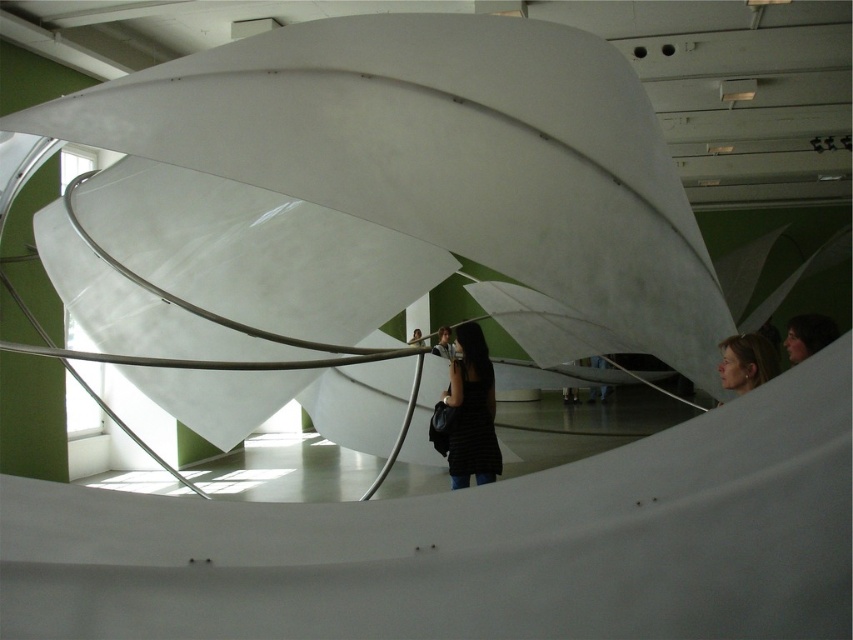
Question: Can you confirm if black matte dress at center is wider than matte black hair at upper right?

Choices:
 (A) yes
 (B) no

Answer: (A)

Question: Among these objects, which one is nearest to the camera?

Choices:
 (A) black matte dress at center
 (B) matte black hair at upper right

Answer: (B)

Question: Does black matte dress at center lie behind matte black hair at upper right?

Choices:
 (A) no
 (B) yes

Answer: (B)

Question: Does black matte dress at center appear over matte black hair at upper right?

Choices:
 (A) yes
 (B) no

Answer: (B)